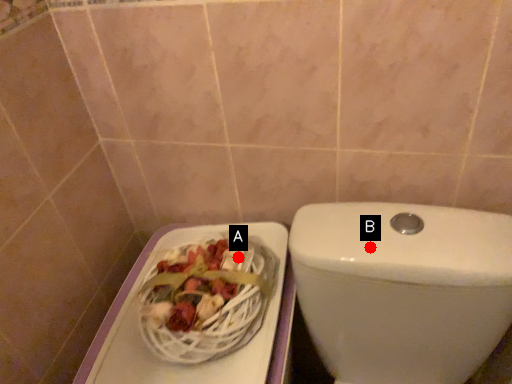
Question: Two points are circled on the image, labeled by A and B beside each circle. Which of the following is the farthest from the observer?

Choices:
 (A) A is further
 (B) B is further

Answer: (A)